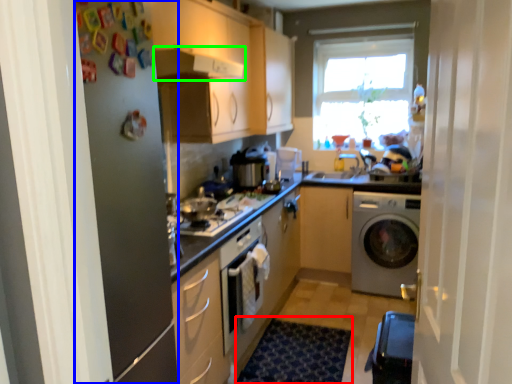
Question: Estimate the real-world distances between objects in this image. Which object is farther from doormat (highlighted by a red box), screen door (highlighted by a blue box) or exhaust hood (highlighted by a green box)?

Choices:
 (A) screen door
 (B) exhaust hood

Answer: (B)